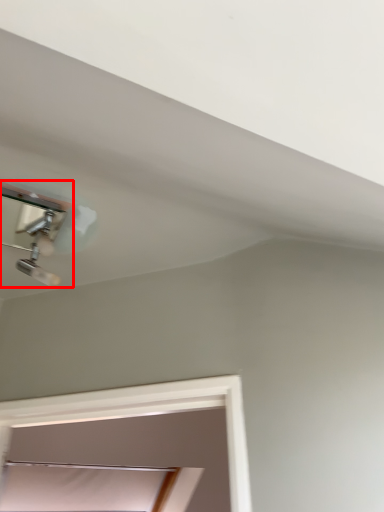
Question: Where is lamp (annotated by the red box) located in relation to window in the image?

Choices:
 (A) left
 (B) right

Answer: (B)